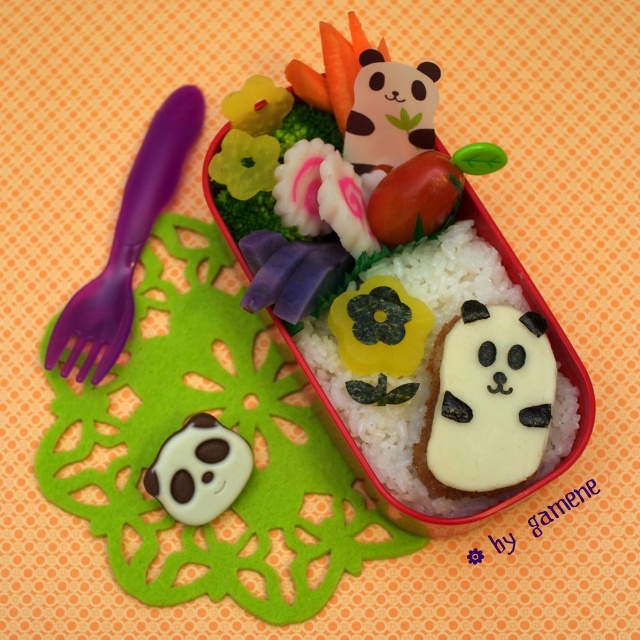
Can you confirm if white rice at center is positioned to the right of matte tomato at upper center?

Indeed, white rice at center is positioned on the right side of matte tomato at upper center.

Who is higher up, white rice at center or matte tomato at upper center?

matte tomato at upper center is above.

Who is more distant from viewer, (380, 476) or (390, 172)?

The point (390, 172) is behind.

The width and height of the screenshot is (640, 640). Find the location of `white rice at center`. white rice at center is located at coordinates (380, 424).

Which is more to the right, white cheese at center or matte tomato at upper center?

Positioned to the right is white cheese at center.

Is point (444, 362) behind point (432, 154)?

No, it is not.

You are a GUI agent. You are given a task and a screenshot of the screen. Output one action in this format:
    pyautogui.click(x=<x>, y=<y>)
    Task: Click on the white cheese at center
    The width and height of the screenshot is (640, 640).
    Given the screenshot: What is the action you would take?
    tap(486, 401)

Is purple plastic fork at left in front of matte tomato at upper center?

No, purple plastic fork at left is further to the viewer.

Between point (81, 296) and point (426, 186), which one is positioned in front?

Positioned in front is point (426, 186).

What are the coordinates of `purple plastic fork at left` in the screenshot? It's located at (128, 243).